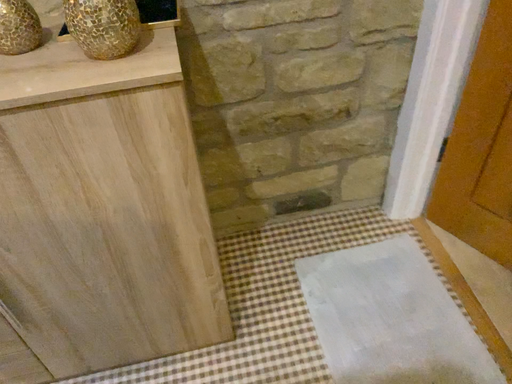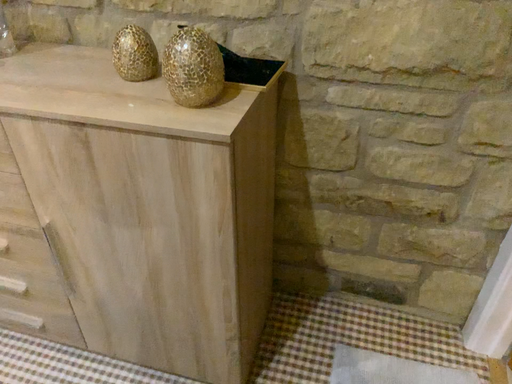
Question: How did the camera likely rotate when shooting the video?

Choices:
 (A) rotated left
 (B) rotated right

Answer: (A)